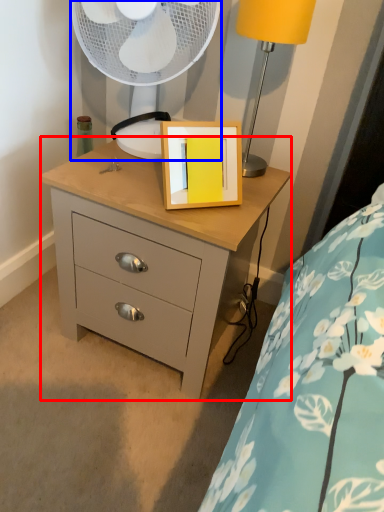
Question: Which of the following is the closest to the observer, chest of drawers (highlighted by a red box) or mechanical fan (highlighted by a blue box)?

Choices:
 (A) chest of drawers
 (B) mechanical fan

Answer: (A)